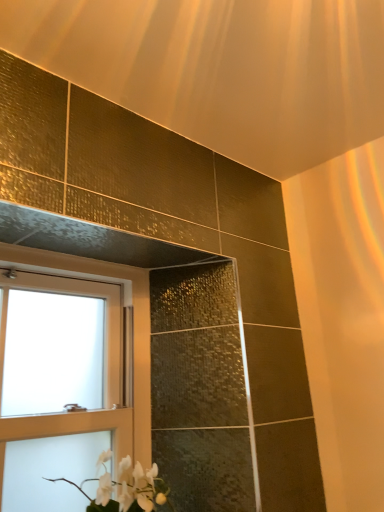
Describe the element at coordinates (120, 308) in the screenshot. I see `white frosted glass window at lower left` at that location.

Where is `white frosted glass window at lower left`? The image size is (384, 512). white frosted glass window at lower left is located at coordinates (120, 308).

Locate an element on the screen. This screenshot has height=512, width=384. white frosted glass window at lower left is located at coordinates (120, 308).